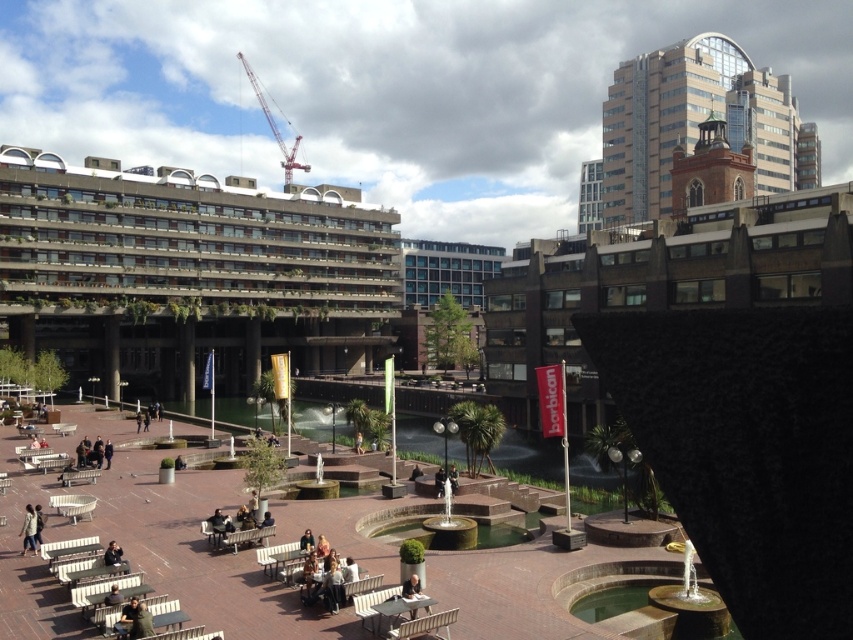
Which of these two, red metallic crane at upper center or dark gray jacket at center, stands taller?

red metallic crane at upper center is taller.

Does red metallic crane at upper center appear under dark gray jacket at center?

No, red metallic crane at upper center is not below dark gray jacket at center.

Where is `red metallic crane at upper center`? red metallic crane at upper center is located at coordinates (276, 129).

Is point (672, 632) closer to viewer compared to point (28, 516)?

Yes.

Does smooth stone fountain at center appear on the right side of light brown leather jacket at lower left?

Correct, you'll find smooth stone fountain at center to the right of light brown leather jacket at lower left.

Does point (596, 586) lie in front of point (33, 529)?

Yes, point (596, 586) is closer to viewer.

Image resolution: width=853 pixels, height=640 pixels. Find the location of `smooth stone fountain at center`. smooth stone fountain at center is located at coordinates (651, 600).

Who is positioned more to the right, smooth stone fountain at center or dark gray jacket at center?

Positioned to the right is smooth stone fountain at center.

Is point (583, 577) positioned in front of point (436, 486)?

Yes, point (583, 577) is closer to viewer.

The image size is (853, 640). What are the coordinates of `smooth stone fountain at center` in the screenshot? It's located at (651, 600).